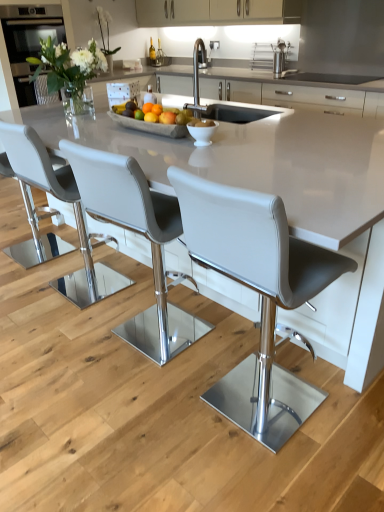
Identify the location of vacant space in between white leather stool at center, the 2th chair when ordered from right to left, and white leather chair at left, which appears as the third chair when viewed from the right. (108, 312).